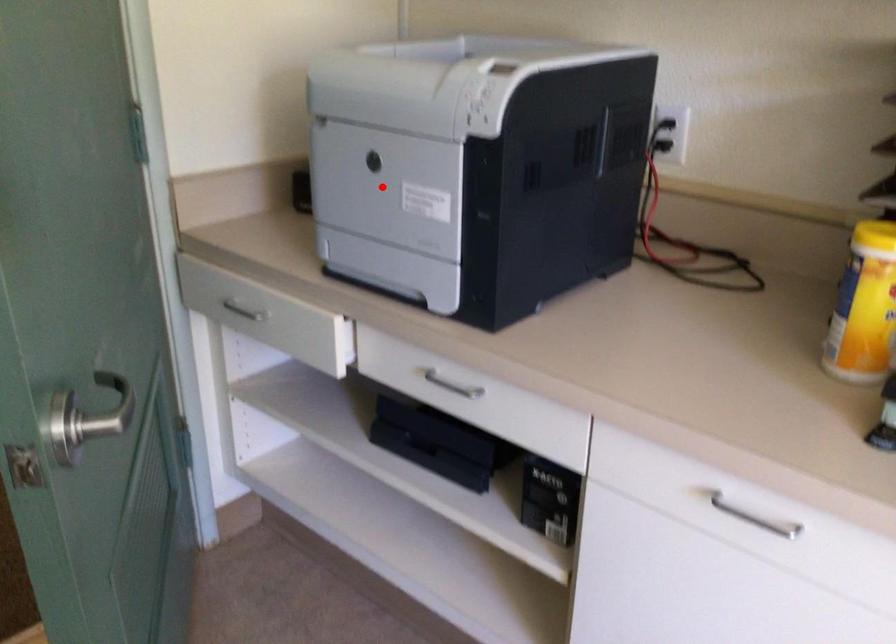
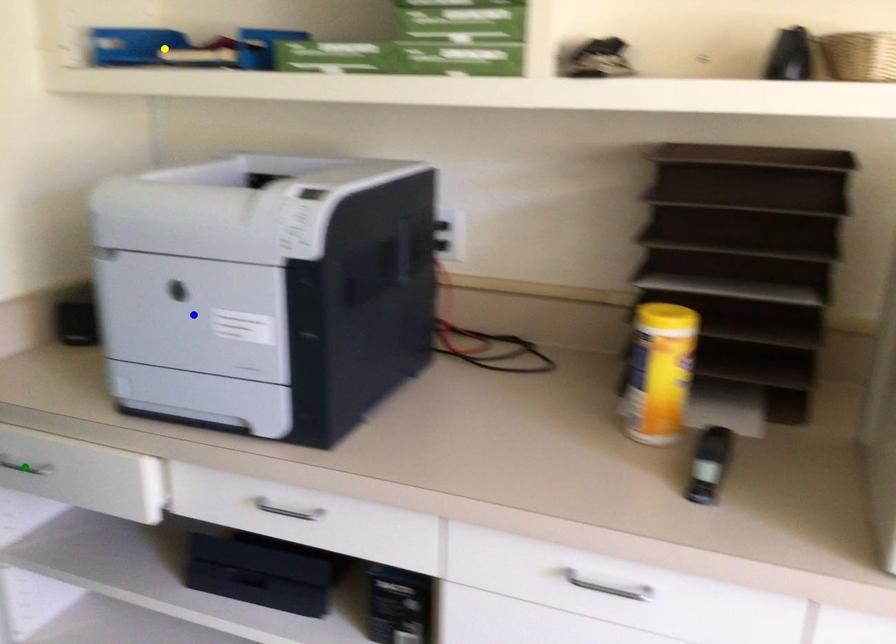
Question: I am providing you with two images of the same scene from different viewpoints. A red point is marked on the first image. You are given multiple points on the second image. Which spot in image 2 lines up with the point in image 1?

Choices:
 (A) blue point
 (B) yellow point
 (C) green point

Answer: (A)